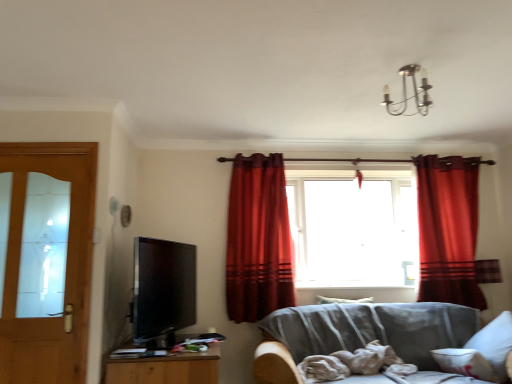
The width and height of the screenshot is (512, 384). Identify the location of free point above chrome metallic chandelier at upper center (from a real-world perspective). (412, 62).